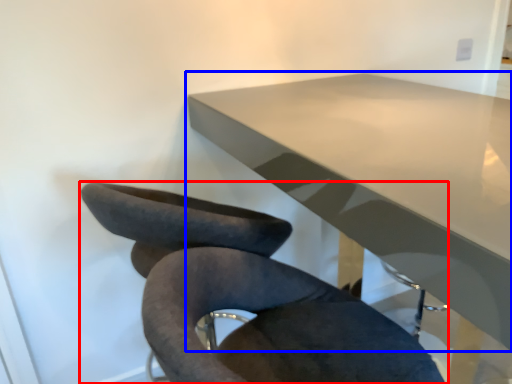
Question: Which object appears closest to the camera in this image, chair (highlighted by a red box) or table (highlighted by a blue box)?

Choices:
 (A) chair
 (B) table

Answer: (A)